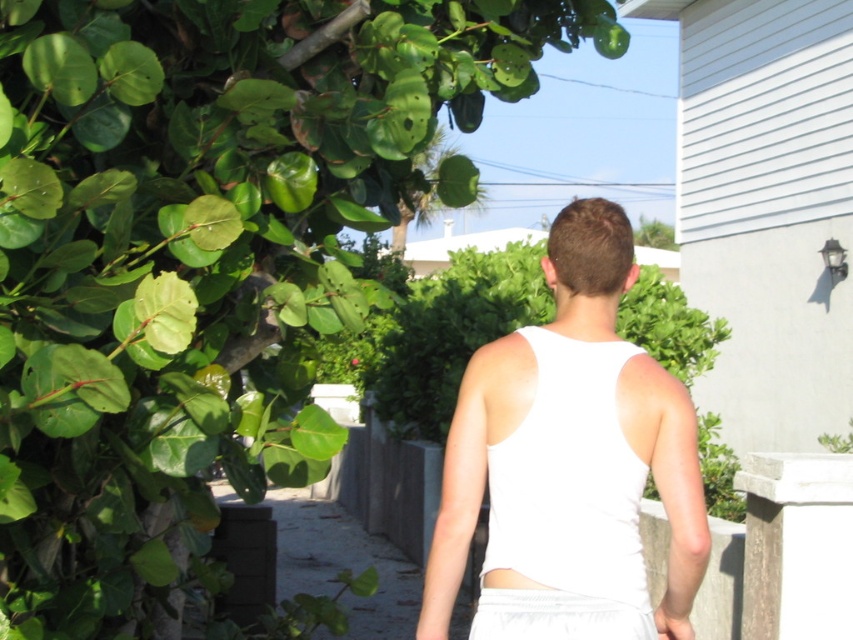
You are a fashion designer observing a model wearing both a white fabric tank top at center and a white matte vest at center. Which clothing item is visible on top?

The white fabric tank top at center is above the white matte vest at center, so the tank top is visible on top.

You are standing at the point with coordinates point (556, 337) and want to walk to the point with coordinates point (83, 592). Given that the person in the image is walking away from you, which direction should you move relative to the person to reach your destination?

Since point (83, 592) is in front of point (556, 337), you should move in the same direction the person is walking to reach your destination.

You are standing at the camera position and want to take a photo of the green leafy tree at upper left. What is the coordinate of the tree in the image?

The coordinate of the green leafy tree at upper left is at point (202, 256).